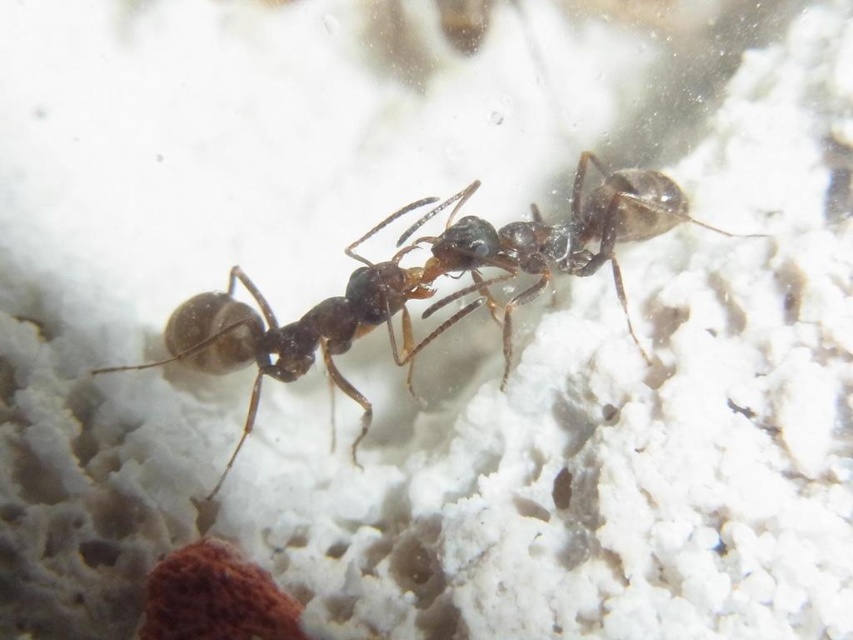
You are an entomologist observing two ants on a white surface. You notice a brown glossy ant at center and a shiny black ant at center. Which ant do you think is bigger?

The brown glossy ant at center is larger in size compared to the shiny black ant at center.

You are observing two ants on a white surface. One is a brown glossy ant at center. Where is the point with coordinates point (328, 314) located?

The point with coordinates point (328, 314) is located on the brown glossy ant at center.